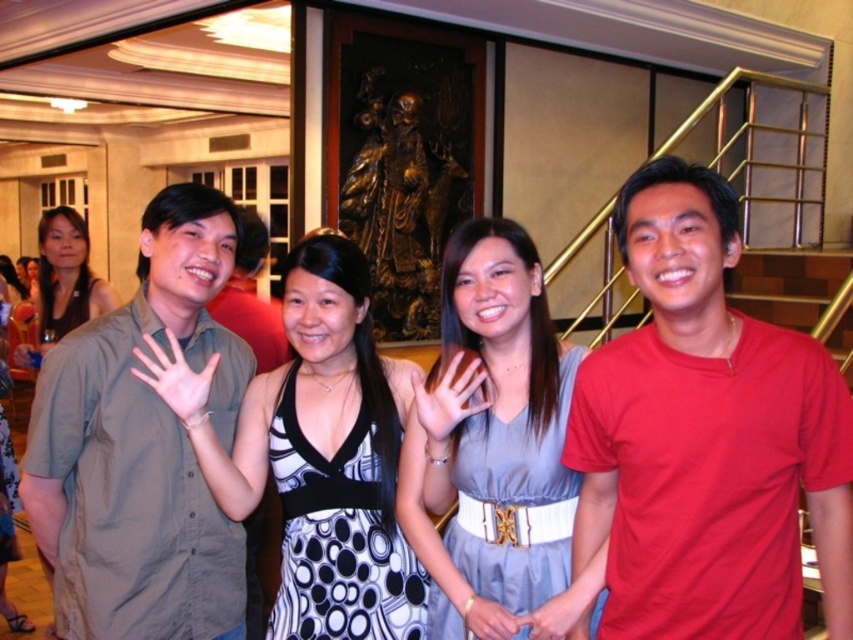
Between matte khaki shirt at center and black dotted dress at center, which one appears on the left side from the viewer's perspective?

Positioned to the left is matte khaki shirt at center.

Based on the photo, between matte khaki shirt at center and black dotted dress at center, which one is positioned lower?

Positioned lower is black dotted dress at center.

Between point (91, 588) and point (334, 406), which one is positioned behind?

The point (334, 406) is more distant.

Image resolution: width=853 pixels, height=640 pixels. Find the location of `matte khaki shirt at center`. matte khaki shirt at center is located at coordinates 141,448.

Is red cotton t-shirt at center thinner than matte black dress at left?

Yes, red cotton t-shirt at center is thinner than matte black dress at left.

At what (x,y) coordinates should I click in order to perform the action: click on red cotton t-shirt at center. Please return your answer as a coordinate pair (x, y). Looking at the image, I should click on (706, 436).

Between matte khaki shirt at center and matte gray shirt at left, which one appears on the right side from the viewer's perspective?

matte khaki shirt at center

Between matte khaki shirt at center and matte gray shirt at left, which one has less height?

With less height is matte gray shirt at left.

The image size is (853, 640). I want to click on matte khaki shirt at center, so click(x=141, y=448).